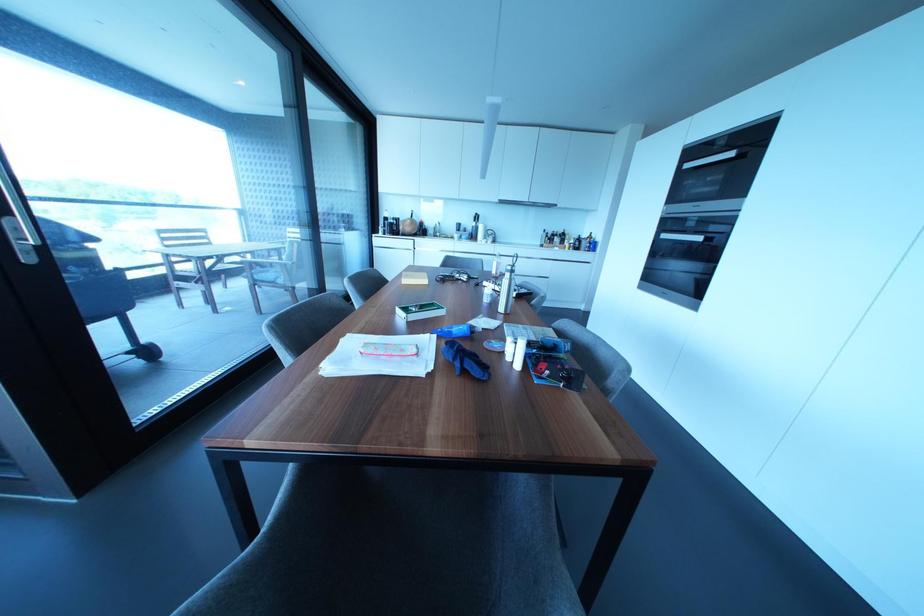
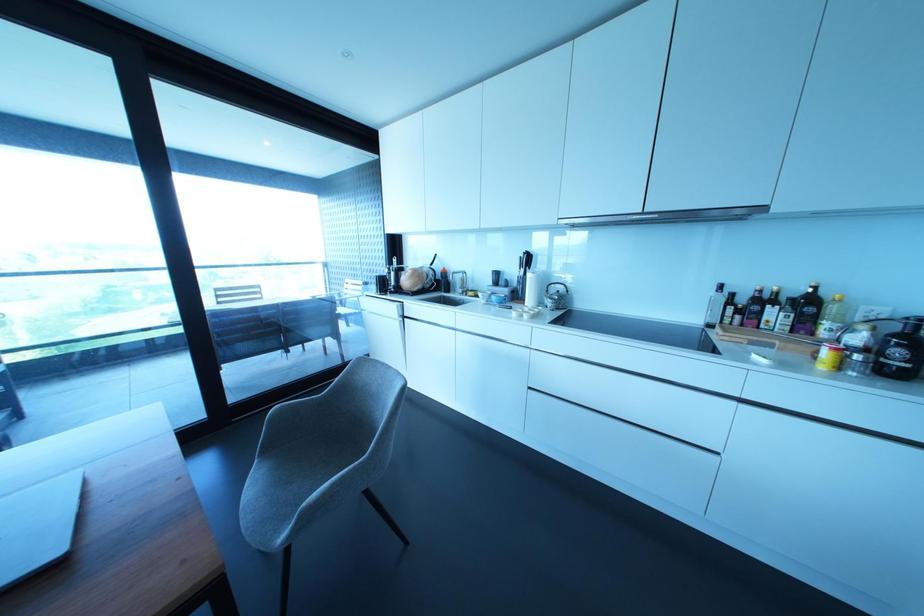
Find the pixel in the second image that matches [490,238] in the first image.

(549, 302)